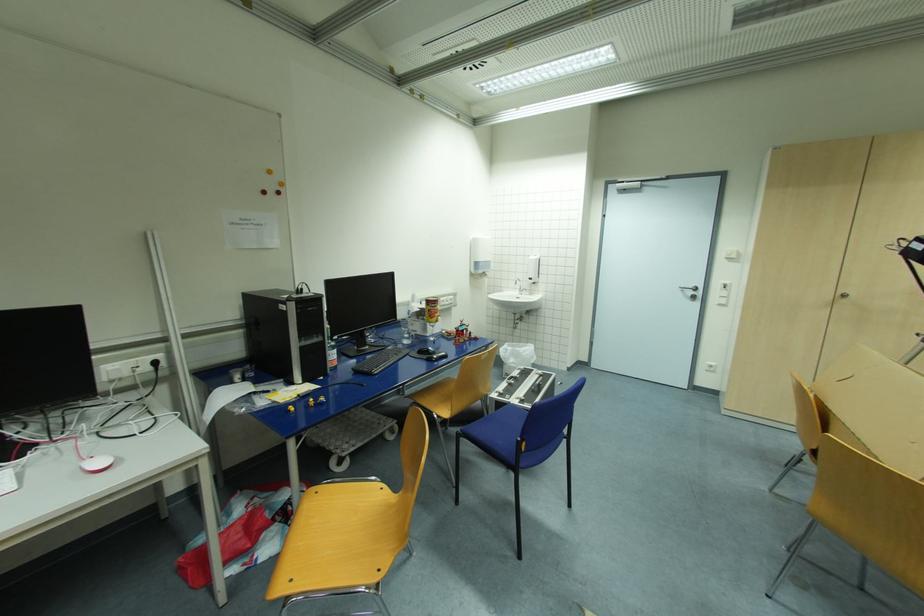
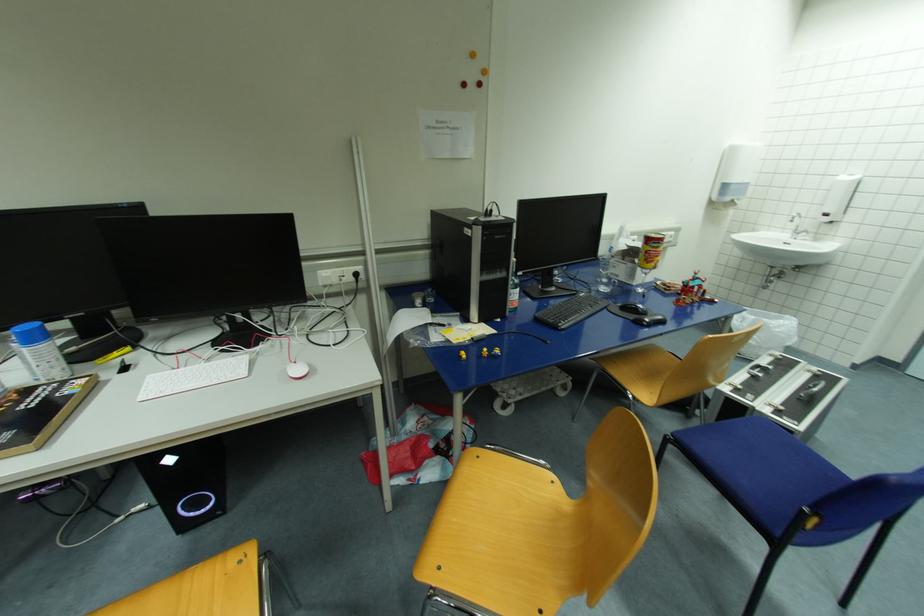
The point at (320, 493) is marked in the first image. Where is the corresponding point in the second image?

(481, 459)